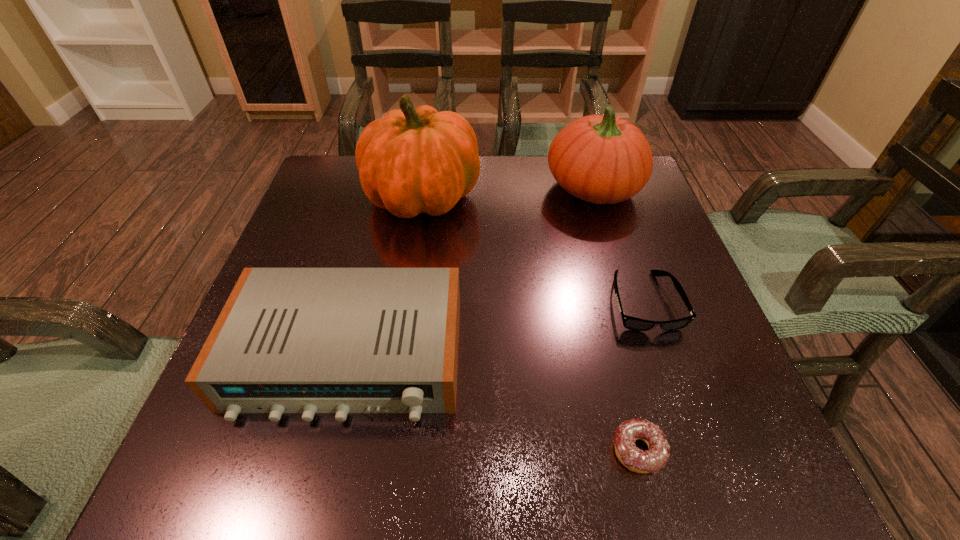
I want to click on object positioned at the near right corner, so click(651, 461).

You are a GUI agent. You are given a task and a screenshot of the screen. Output one action in this format:
    pyautogui.click(x=<x>, y=<y>)
    Task: Click on the vacant space at the far edge of the desktop
    
    Given the screenshot: What is the action you would take?
    pyautogui.click(x=459, y=207)

You are a GUI agent. You are given a task and a screenshot of the screen. Output one action in this format:
    pyautogui.click(x=<x>, y=<y>)
    Task: Click on the vacant space at the near edge of the desktop
    
    Given the screenshot: What is the action you would take?
    pyautogui.click(x=543, y=488)

Identify the location of vacant region at the right edge of the desktop. (692, 377).

Locate an element on the screen. The width and height of the screenshot is (960, 540). vacant space at the far left corner of the desktop is located at coordinates (355, 161).

Where is `free space at the near right corner of the desktop`? free space at the near right corner of the desktop is located at coordinates (673, 489).

Where is `free spot between the right pumpkin and the left pumpkin`? free spot between the right pumpkin and the left pumpkin is located at coordinates (508, 192).

This screenshot has height=540, width=960. In order to click on free space between the shorter pumpkin and the left pumpkin in this screenshot , I will do `click(508, 192)`.

Locate an element on the screen. vacant region between the left pumpkin and the sunglasses is located at coordinates (533, 248).

Where is `free point between the sunglasses and the shorter pumpkin`? free point between the sunglasses and the shorter pumpkin is located at coordinates (618, 245).